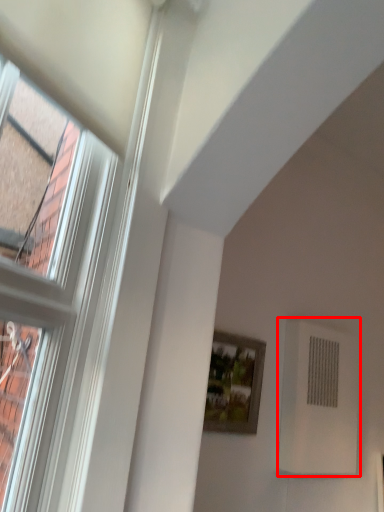
Question: From the image's perspective, what is the correct spatial relationship of air conditioning (annotated by the red box) in relation to picture frame?

Choices:
 (A) below
 (B) above

Answer: (A)